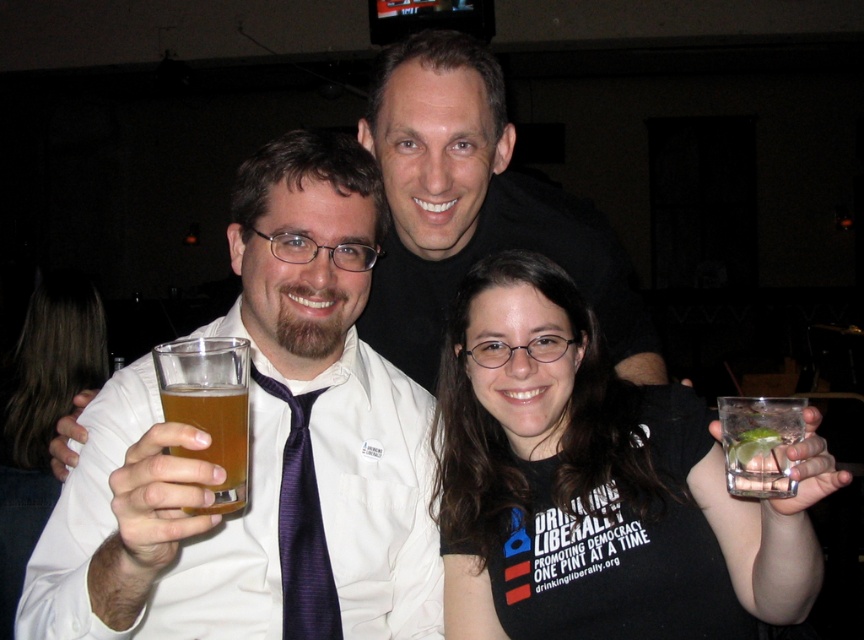
Question: Among these points, which one is farthest from the camera?

Choices:
 (A) (347, 632)
 (B) (314, 627)

Answer: (A)

Question: Can you confirm if black matte t-shirt at center is positioned above purple silk tie at center?

Choices:
 (A) yes
 (B) no

Answer: (A)

Question: Does black matte shirt at center have a greater width compared to purple silk tie at center?

Choices:
 (A) yes
 (B) no

Answer: (A)

Question: Which point is farther from the camera taking this photo?

Choices:
 (A) (740, 461)
 (B) (201, 362)
 (C) (312, 579)

Answer: (C)

Question: Is black matte shirt at center above purple silk tie at center?

Choices:
 (A) yes
 (B) no

Answer: (B)

Question: Estimate the real-world distances between objects in this image. Which object is farther from the clear glass at lower right?

Choices:
 (A) black matte shirt at center
 (B) black matte t-shirt at center
 (C) purple silk tie at center

Answer: (A)